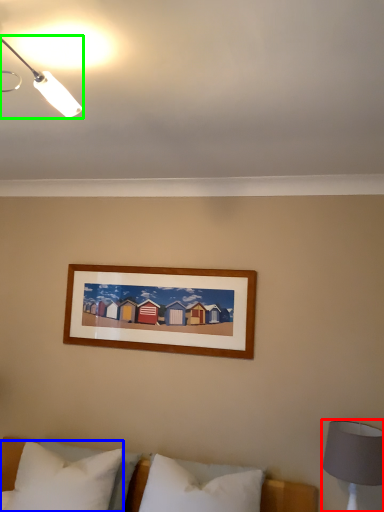
Question: Which object is the farthest from bedside lamp (highlighted by a red box)? Choose among these: pillow (highlighted by a blue box) or lamp (highlighted by a green box).

Choices:
 (A) pillow
 (B) lamp

Answer: (B)